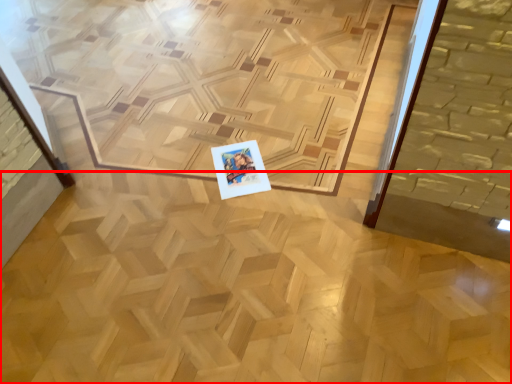
Question: From the image's perspective, what is the correct spatial positioning of plywood (annotated by the red box) in reference to postcard?

Choices:
 (A) below
 (B) above

Answer: (B)